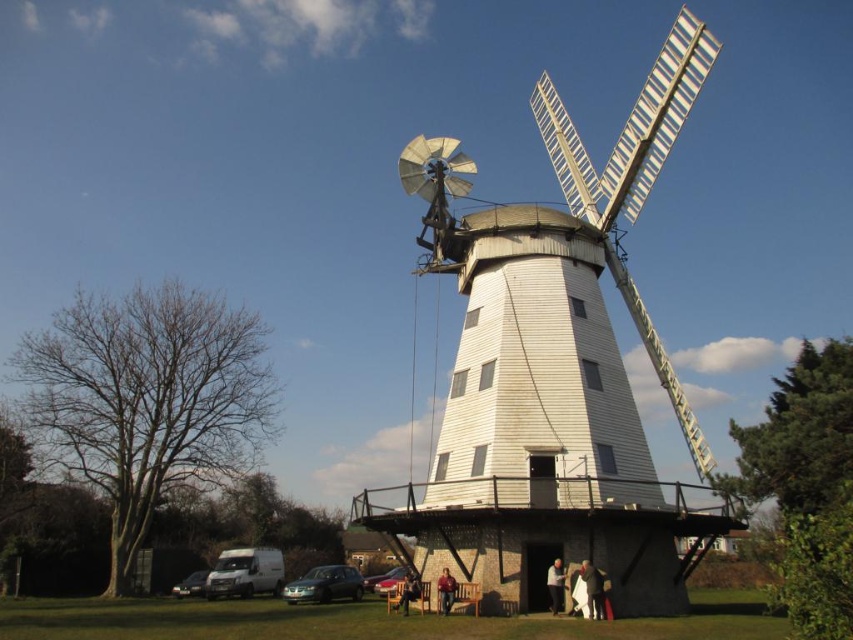
You are a visitor at the windmill and want to sit down. You see the metallic gray hatchback at lower center and the light brown wooden chair at lower center. Which object is more suitable for sitting?

The light brown wooden chair at lower center is suitable for sitting, while the metallic gray hatchback at lower center is a vehicle and not meant for sitting.

You are standing at the base of the windmill and want to pick up the brown leather jacket at lower center. Is the metallic silver car at center blocking your path?

The metallic silver car at center is further to the viewer than the brown leather jacket at lower center, so the car is closer to you. This means the metallic silver car at center is blocking your path to the brown leather jacket at lower center.